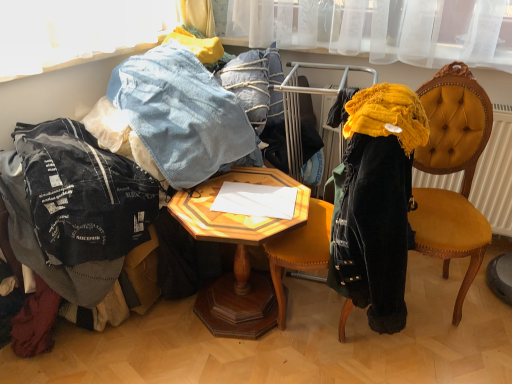
In order to face velvet yellow chair at right, should I rotate leftwards or rightwards?

Turn right by 23.474 degrees to look at velvet yellow chair at right.

Image resolution: width=512 pixels, height=384 pixels. What do you see at coordinates (76, 204) in the screenshot? I see `ripped denim jacket at lower left` at bounding box center [76, 204].

Find the location of a particular element. This screenshot has width=512, height=384. denim at left is located at coordinates (181, 114).

Which of these two, wooden hexagonal table at center or denim at left, is smaller?

Smaller between the two is wooden hexagonal table at center.

Is wooden hexagonal table at center touching denim at left?

No, wooden hexagonal table at center is not beside denim at left.

In terms of height, does wooden hexagonal table at center look taller or shorter compared to denim at left?

Clearly, wooden hexagonal table at center is taller compared to denim at left.

Is wooden hexagonal table at center oriented away from denim at left?

No, wooden hexagonal table at center's orientation is not away from denim at left.

Does denim at left appear on the left side of wooden hexagonal table at center?

Correct, you'll find denim at left to the left of wooden hexagonal table at center.

Is denim at left positioned before wooden hexagonal table at center?

That is True.

Is denim at left not close to wooden hexagonal table at center?

Actually, denim at left and wooden hexagonal table at center are a little close together.

From a real-world perspective, which is physically above, denim at left or wooden hexagonal table at center?

In real-world perspective, denim at left is above.

From a real-world perspective, between velvet yellow chair at right and wooden hexagonal table at center, who is vertically higher?

From a 3D spatial view, velvet yellow chair at right is above.

Is velvet yellow chair at right at the left side of wooden hexagonal table at center?

No, velvet yellow chair at right is not to the left of wooden hexagonal table at center.

In the image, there is a velvet yellow chair at right. Where is `desk below it (from the image's perspective)`? This screenshot has width=512, height=384. desk below it (from the image's perspective) is located at coordinates (237, 252).

Which is in front, velvet yellow chair at right or wooden hexagonal table at center?

Positioned in front is velvet yellow chair at right.

Which of these two, ripped denim jacket at lower left or denim at left, is thinner?

denim at left is thinner.

Considering the relative positions of ripped denim jacket at lower left and denim at left in the image provided, is ripped denim jacket at lower left in front of denim at left?

Yes, ripped denim jacket at lower left is closer to the camera.

This screenshot has width=512, height=384. In order to click on trousers that is above the ripped denim jacket at lower left (from a real-world perspective) in this screenshot , I will do `click(181, 114)`.

Between ripped denim jacket at lower left and denim at left, which one appears on the right side from the viewer's perspective?

denim at left is more to the right.

From the picture: Is ripped denim jacket at lower left closer to the viewer compared to wooden hexagonal table at center?

Yes, it is.

Consider the image. Considering the sizes of objects ripped denim jacket at lower left and wooden hexagonal table at center in the image provided, who is thinner, ripped denim jacket at lower left or wooden hexagonal table at center?

wooden hexagonal table at center is thinner.

Based on the photo, is there a large distance between ripped denim jacket at lower left and wooden hexagonal table at center?

Actually, ripped denim jacket at lower left and wooden hexagonal table at center are a little close together.

Would you say ripped denim jacket at lower left is inside or outside wooden hexagonal table at center?

ripped denim jacket at lower left is spatially situated outside wooden hexagonal table at center.

How different are the orientations of wooden hexagonal table at center and velvet yellow chair at right in degrees?

41.3 degrees separate the facing orientations of wooden hexagonal table at center and velvet yellow chair at right.

In the scene shown: How far apart are wooden hexagonal table at center and velvet yellow chair at right?

A distance of 62.94 centimeters exists between wooden hexagonal table at center and velvet yellow chair at right.

Is velvet yellow chair at right located within wooden hexagonal table at center?

No, velvet yellow chair at right is not surrounded by wooden hexagonal table at center.

Is wooden hexagonal table at center facing away from velvet yellow chair at right?

wooden hexagonal table at center does not have its back to velvet yellow chair at right.

From the image's perspective, is velvet yellow chair at right beneath denim at left?

Yes, from the image's perspective, velvet yellow chair at right is below denim at left.

In the scene shown: Which of these two, velvet yellow chair at right or denim at left, stands taller?

With more height is velvet yellow chair at right.

Does point (419, 238) come behind point (211, 150)?

No, it is in front of (211, 150).

From the picture: Between velvet yellow chair at right and denim at left, which one has smaller size?

denim at left is smaller.

This screenshot has width=512, height=384. I want to click on desk that appears behind the denim at left, so click(x=237, y=252).

The width and height of the screenshot is (512, 384). In order to click on trousers in front of the wooden hexagonal table at center in this screenshot , I will do `click(181, 114)`.

Estimate the real-world distances between objects in this image. Which object is further from ripped denim jacket at lower left, denim at left or velvet yellow chair at right?

Based on the image, velvet yellow chair at right appears to be further to ripped denim jacket at lower left.

Based on their spatial positions, is ripped denim jacket at lower left or denim at left further from wooden hexagonal table at center?

ripped denim jacket at lower left is positioned further to the anchor wooden hexagonal table at center.

Looking at the image, which one is located further to ripped denim jacket at lower left, velvet yellow chair at right or wooden hexagonal table at center?

velvet yellow chair at right.

From the image, which object appears to be farther from ripped denim jacket at lower left, wooden hexagonal table at center or velvet yellow chair at right?

velvet yellow chair at right is positioned further to the anchor ripped denim jacket at lower left.

Estimate the real-world distances between objects in this image. Which object is further from wooden hexagonal table at center, denim at left or velvet yellow chair at right?

Among the two, velvet yellow chair at right is located further to wooden hexagonal table at center.

Based on their spatial positions, is velvet yellow chair at right or ripped denim jacket at lower left closer to denim at left?

ripped denim jacket at lower left is closer to denim at left.

Based on their spatial positions, is denim at left or ripped denim jacket at lower left closer to velvet yellow chair at right?

denim at left is positioned closer to the anchor velvet yellow chair at right.

Estimate the real-world distances between objects in this image. Which object is further from ripped denim jacket at lower left, wooden hexagonal table at center or denim at left?

Among the two, wooden hexagonal table at center is located further to ripped denim jacket at lower left.

Identify the location of desk situated between denim at left and velvet yellow chair at right from left to right. (237, 252).

Where is `desk between ripped denim jacket at lower left and velvet yellow chair at right from left to right`? desk between ripped denim jacket at lower left and velvet yellow chair at right from left to right is located at coordinates (237, 252).

The image size is (512, 384). Find the location of `trousers between ripped denim jacket at lower left and velvet yellow chair at right`. trousers between ripped denim jacket at lower left and velvet yellow chair at right is located at coordinates (181, 114).

This screenshot has width=512, height=384. Identify the location of trousers between ripped denim jacket at lower left and wooden hexagonal table at center in the horizontal direction. (181, 114).